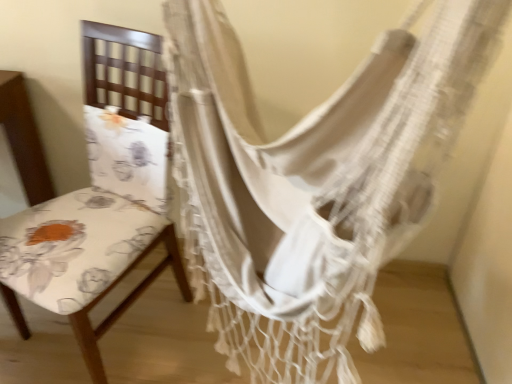
Question: Is floral fabric chair at left far from white woven hammock at center?

Choices:
 (A) yes
 (B) no

Answer: (B)

Question: Can you confirm if floral fabric chair at left is taller than white woven hammock at center?

Choices:
 (A) yes
 (B) no

Answer: (A)

Question: Is floral fabric chair at left aimed at white woven hammock at center?

Choices:
 (A) yes
 (B) no

Answer: (B)

Question: Is floral fabric chair at left in front of white woven hammock at center?

Choices:
 (A) yes
 (B) no

Answer: (B)

Question: Can you confirm if floral fabric chair at left is smaller than white woven hammock at center?

Choices:
 (A) yes
 (B) no

Answer: (A)

Question: Could white woven hammock at center be considered to be inside floral fabric chair at left?

Choices:
 (A) no
 (B) yes

Answer: (A)

Question: From a real-world perspective, is white woven hammock at center positioned under floral fabric chair at left based on gravity?

Choices:
 (A) yes
 (B) no

Answer: (B)

Question: From a real-world perspective, is white woven hammock at center located higher than floral fabric chair at left?

Choices:
 (A) yes
 (B) no

Answer: (A)

Question: Would you say white woven hammock at center is a long distance from floral fabric chair at left?

Choices:
 (A) no
 (B) yes

Answer: (A)

Question: Considering the relative sizes of white woven hammock at center and floral fabric chair at left in the image provided, is white woven hammock at center smaller than floral fabric chair at left?

Choices:
 (A) no
 (B) yes

Answer: (A)

Question: Is the depth of white woven hammock at center greater than that of floral fabric chair at left?

Choices:
 (A) yes
 (B) no

Answer: (B)

Question: Considering the relative positions of white woven hammock at center and floral fabric chair at left in the image provided, is white woven hammock at center to the left of floral fabric chair at left from the viewer's perspective?

Choices:
 (A) yes
 (B) no

Answer: (B)

Question: Considering the positions of white woven hammock at center and floral fabric chair at left in the image, is white woven hammock at center taller or shorter than floral fabric chair at left?

Choices:
 (A) tall
 (B) short

Answer: (B)